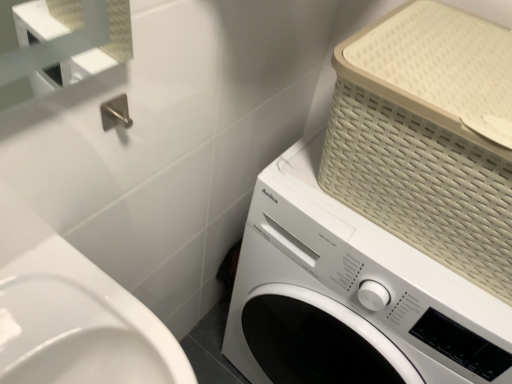
This screenshot has width=512, height=384. What do you see at coordinates (351, 296) in the screenshot?
I see `white matte washing machine at center` at bounding box center [351, 296].

This screenshot has width=512, height=384. What are the coordinates of `white matte washing machine at center` in the screenshot? It's located at (351, 296).

Describe the element at coordinates (426, 138) in the screenshot. I see `beige woven basket at upper right` at that location.

In order to click on beige woven basket at upper right in this screenshot , I will do `click(426, 138)`.

What is the approximate height of beige woven basket at upper right?

It is 11.01 inches.

I want to click on white matte washing machine at center, so (x=351, y=296).

Consider the image. Is white matte washing machine at center at the left side of beige woven basket at upper right?

Indeed, white matte washing machine at center is positioned on the left side of beige woven basket at upper right.

Which object is closer to the camera, white matte washing machine at center or beige woven basket at upper right?

Positioned in front is beige woven basket at upper right.

Is point (433, 262) behind point (425, 53)?

Yes, it is behind point (425, 53).

From the image's perspective, between white matte washing machine at center and beige woven basket at upper right, which one is located above?

beige woven basket at upper right appears higher in the image.

From a real-world perspective, is white matte washing machine at center under beige woven basket at upper right?

Yes, from a real-world perspective, white matte washing machine at center is under beige woven basket at upper right.

Can you confirm if white matte washing machine at center is wider than beige woven basket at upper right?

Correct, the width of white matte washing machine at center exceeds that of beige woven basket at upper right.

Considering the relative sizes of white matte washing machine at center and beige woven basket at upper right in the image provided, is white matte washing machine at center taller than beige woven basket at upper right?

Indeed, white matte washing machine at center has a greater height compared to beige woven basket at upper right.

Based on the photo, considering the relative sizes of white matte washing machine at center and beige woven basket at upper right in the image provided, is white matte washing machine at center smaller than beige woven basket at upper right?

No, white matte washing machine at center is not smaller than beige woven basket at upper right.

Is white matte washing machine at center situated inside beige woven basket at upper right or outside?

white matte washing machine at center is outside beige woven basket at upper right.

Is white matte washing machine at center beside beige woven basket at upper right?

No, white matte washing machine at center is not beside beige woven basket at upper right.

Is white matte washing machine at center turned away from beige woven basket at upper right?

white matte washing machine at center does not have its back to beige woven basket at upper right.

How many degrees apart are the facing directions of white matte washing machine at center and beige woven basket at upper right?

They differ by 7.28e-05 degrees in their facing directions.

Locate an element on the screen. This screenshot has width=512, height=384. basket above the white matte washing machine at center (from a real-world perspective) is located at coordinates (426, 138).

Considering the relative positions of beige woven basket at upper right and white matte washing machine at center in the image provided, is beige woven basket at upper right to the left of white matte washing machine at center from the viewer's perspective?

No, beige woven basket at upper right is not to the left of white matte washing machine at center.

Does beige woven basket at upper right come behind white matte washing machine at center?

No, it is not.

Which is more distant, (422, 176) or (339, 324)?

The point (339, 324) is farther.

From the image's perspective, is beige woven basket at upper right located above or below white matte washing machine at center?

From the image's perspective, beige woven basket at upper right appears above white matte washing machine at center.

From a real-world perspective, which object rests below the other?

white matte washing machine at center is physically lower.

Which object is wider, beige woven basket at upper right or white matte washing machine at center?

white matte washing machine at center.

Which of these two, beige woven basket at upper right or white matte washing machine at center, stands taller?

white matte washing machine at center is taller.

Who is smaller, beige woven basket at upper right or white matte washing machine at center?

Smaller between the two is beige woven basket at upper right.

Would you say beige woven basket at upper right is outside white matte washing machine at center?

Indeed, beige woven basket at upper right is completely outside white matte washing machine at center.

Is beige woven basket at upper right beside white matte washing machine at center?

beige woven basket at upper right is not next to white matte washing machine at center, and they're not touching.

Is beige woven basket at upper right facing away from white matte washing machine at center?

No, beige woven basket at upper right is not facing away from white matte washing machine at center.

Can you tell me how much beige woven basket at upper right and white matte washing machine at center differ in facing direction?

The facing directions of beige woven basket at upper right and white matte washing machine at center are 7.28e-05 degrees apart.

Image resolution: width=512 pixels, height=384 pixels. Identify the location of washing machine beneath the beige woven basket at upper right (from a real-world perspective). (351, 296).

Find the location of a particular element. basket that is above the white matte washing machine at center (from the image's perspective) is located at coordinates (426, 138).

There is a white matte washing machine at center. Find the location of `basket above it (from a real-world perspective)`. basket above it (from a real-world perspective) is located at coordinates (426, 138).